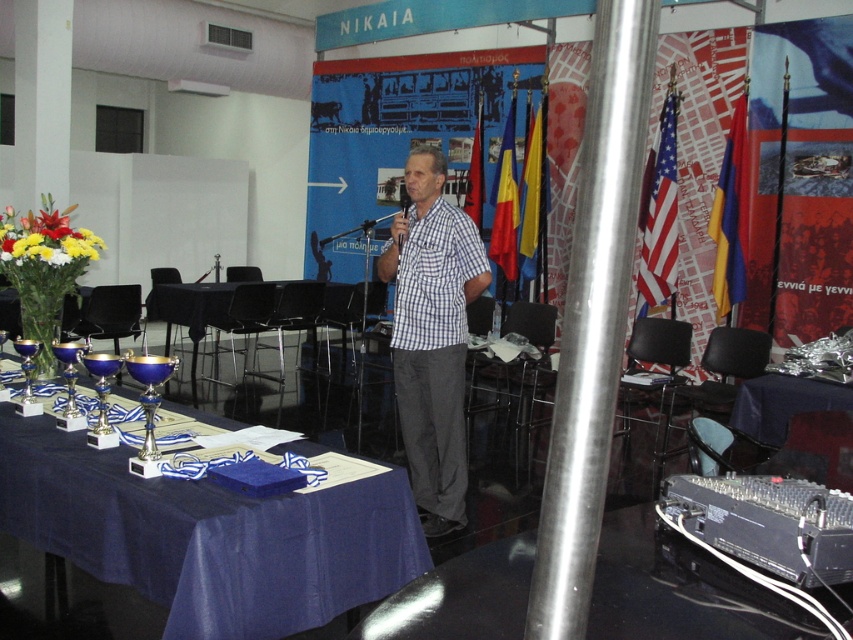
You are an event organizer who needs to ensure that the white checkered shirt at center and the blue fabric table at lower right are visible to all attendees. Given their sizes, which object might require a more strategic placement to ensure visibility?

The blue fabric table at lower right might require more strategic placement since it is smaller in size compared to the white checkered shirt at center, making it potentially harder to see from a distance.

You are organizing a small reception after the event and need to place a rectangular 1.2m long tablecloth. The blue fabric table at lower right and the vibrant floral bouquet at left are both in the room. Which object can accommodate the tablecloth without needing adjustments?

The blue fabric table at lower right can accommodate the 1.2m long tablecloth since its width is larger than the vibrant floral bouquet at left.